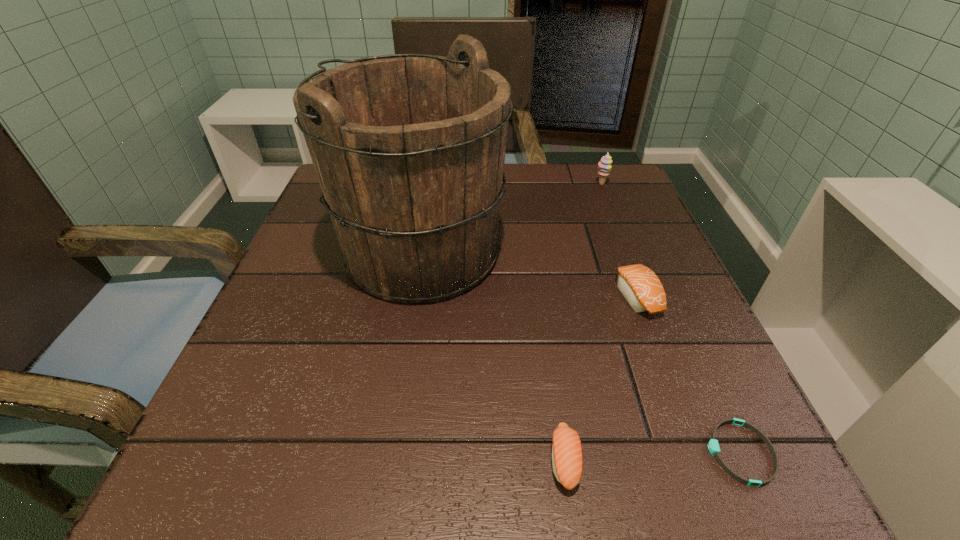
At what (x,y) coordinates should I click in order to perform the action: click on the tallest object. Please return your answer as a coordinate pair (x, y). The width and height of the screenshot is (960, 540). Looking at the image, I should click on (409, 149).

Find the location of a particular element. Image resolution: width=960 pixels, height=540 pixels. bucket is located at coordinates (409, 149).

Identify the location of the second tallest object. (604, 165).

Find the location of a particular element. The image size is (960, 540). sherbert is located at coordinates (604, 165).

You are a GUI agent. You are given a task and a screenshot of the screen. Output one action in this format:
    pyautogui.click(x=<x>, y=<y>)
    Task: Click on the farther sushi
    
    Given the screenshot: What is the action you would take?
    pyautogui.click(x=642, y=289)

Identify the location of the fourth object from right to left. The height and width of the screenshot is (540, 960). (567, 457).

Identify the location of the nearer sushi. This screenshot has width=960, height=540. (567, 457).

You are a GUI agent. You are given a task and a screenshot of the screen. Output one action in this format:
    pyautogui.click(x=<x>, y=<y>)
    Task: Click on the wristband
    
    Given the screenshot: What is the action you would take?
    pyautogui.click(x=713, y=445)

Identify the location of blank space located 0.160m on the right of the leftmost object. (585, 252).

Identify the location of vacant space situated on the front of the second tallest object. (636, 270).